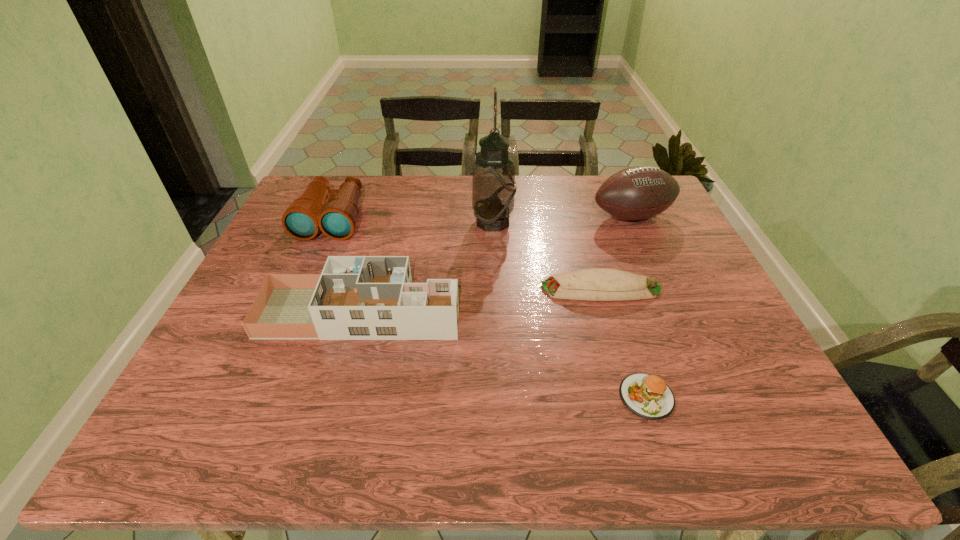
Locate an element on the screen. This screenshot has width=960, height=540. unoccupied position between the football (American) and the tallest object is located at coordinates [x=563, y=219].

You are a GUI agent. You are given a task and a screenshot of the screen. Output one action in this format:
    pyautogui.click(x=<x>, y=<y>)
    Task: Click on the vacant area that lies between the tallest object and the binoculars
    
    Given the screenshot: What is the action you would take?
    pyautogui.click(x=413, y=220)

At what (x,y) coordinates should I click in order to perform the action: click on vacant area between the dollhouse and the patty. Please return your answer as a coordinate pair (x, y). The width and height of the screenshot is (960, 540). Looking at the image, I should click on (504, 355).

Locate an element on the screen. The height and width of the screenshot is (540, 960). free spot between the oil lamp and the burrito is located at coordinates click(x=547, y=255).

You are a GUI agent. You are given a task and a screenshot of the screen. Output one action in this format:
    pyautogui.click(x=<x>, y=<y>)
    Task: Click on the free space between the dollhouse and the nearest object
    The width and height of the screenshot is (960, 540).
    Given the screenshot: What is the action you would take?
    pyautogui.click(x=504, y=355)

I want to click on vacant space that's between the football (American) and the oil lamp, so (563, 219).

This screenshot has width=960, height=540. What are the coordinates of `vacant space that is in between the binoculars and the oil lamp` in the screenshot? It's located at (413, 220).

Locate an element on the screen. vacant area that lies between the fifth shortest object and the patty is located at coordinates tap(639, 307).

This screenshot has height=540, width=960. In order to click on free area in between the second tallest object and the patty in this screenshot , I will do `click(639, 307)`.

I want to click on object that is the closest to the nearest object, so click(594, 284).